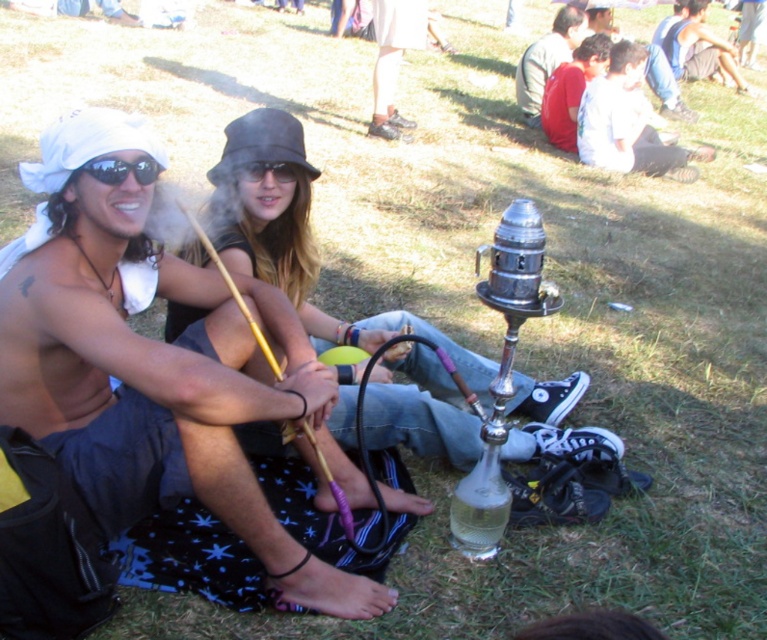
You are standing in the outdoor festival scene. You see a point at coordinates [545,60]. What object is this point located on?

The point at coordinates [545,60] is located on the dark gray fabric jacket at upper right.